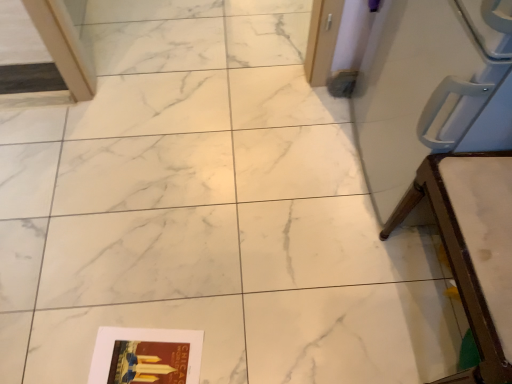
What do you see at coordinates (149, 362) in the screenshot? The height and width of the screenshot is (384, 512). I see `matte paper magazine at lower left` at bounding box center [149, 362].

At what (x,y) coordinates should I click in order to perform the action: click on matte paper magazine at lower left. Please return your answer as a coordinate pair (x, y). Looking at the image, I should click on (149, 362).

I want to click on white plastic chair at right, so click(x=472, y=242).

This screenshot has height=384, width=512. What do you see at coordinates (472, 242) in the screenshot?
I see `white plastic chair at right` at bounding box center [472, 242].

You are a GUI agent. You are given a task and a screenshot of the screen. Output one action in this format:
    pyautogui.click(x=<x>, y=<y>)
    Task: Click on the matte paper magazine at lower left
    Image resolution: width=512 pixels, height=384 pixels.
    Given the screenshot: What is the action you would take?
    pyautogui.click(x=149, y=362)

Can you confirm if matte paper magazine at lower left is positioned to the right of white plastic chair at right?

No.

Considering their positions, is matte paper magazine at lower left located in front of or behind white plastic chair at right?

Visually, matte paper magazine at lower left is located behind white plastic chair at right.

Does point (123, 360) come closer to viewer compared to point (458, 198)?

No, (123, 360) is further to viewer.

From the image's perspective, between matte paper magazine at lower left and white plastic chair at right, who is located below?

matte paper magazine at lower left, from the image's perspective.

From a real-world perspective, who is located lower, matte paper magazine at lower left or white plastic chair at right?

In real-world perspective, matte paper magazine at lower left is lower.

Which of these two, matte paper magazine at lower left or white plastic chair at right, is wider?

white plastic chair at right.

Considering the relative sizes of matte paper magazine at lower left and white plastic chair at right in the image provided, is matte paper magazine at lower left shorter than white plastic chair at right?

Correct, matte paper magazine at lower left is not as tall as white plastic chair at right.

Considering the sizes of matte paper magazine at lower left and white plastic chair at right in the image, is matte paper magazine at lower left bigger or smaller than white plastic chair at right?

In the image, matte paper magazine at lower left appears to be smaller than white plastic chair at right.

Is white plastic chair at right a part of matte paper magazine at lower left?

No.

Are matte paper magazine at lower left and white plastic chair at right beside each other?

No, matte paper magazine at lower left is not next to white plastic chair at right.

Is matte paper magazine at lower left facing away from white plastic chair at right?

Yes, matte paper magazine at lower left's orientation is away from white plastic chair at right.

Can you tell me how much matte paper magazine at lower left and white plastic chair at right differ in facing direction?

The facing directions of matte paper magazine at lower left and white plastic chair at right are 10.9 degrees apart.

In the image, there is a matte paper magazine at lower left. Identify the location of furniture above it (from the image's perspective). (472, 242).

Between white plastic chair at right and matte paper magazine at lower left, which one appears on the right side from the viewer's perspective?

white plastic chair at right.

Does white plastic chair at right lie in front of matte paper magazine at lower left?

Yes, white plastic chair at right is closer to the camera.

Considering the points (470, 176) and (141, 357), which point is in front, point (470, 176) or point (141, 357)?

Point (470, 176)

From the image's perspective, is white plastic chair at right below matte paper magazine at lower left?

Actually, white plastic chair at right appears above matte paper magazine at lower left in the image.

Based on the photo, from a real-world perspective, who is located lower, white plastic chair at right or matte paper magazine at lower left?

matte paper magazine at lower left is physically lower.

Between white plastic chair at right and matte paper magazine at lower left, which one has smaller width?

With smaller width is matte paper magazine at lower left.

From their relative heights in the image, would you say white plastic chair at right is taller or shorter than matte paper magazine at lower left?

Clearly, white plastic chair at right is taller compared to matte paper magazine at lower left.

Does white plastic chair at right have a larger size compared to matte paper magazine at lower left?

Yes, white plastic chair at right is bigger than matte paper magazine at lower left.

Would you say white plastic chair at right is outside matte paper magazine at lower left?

Absolutely, white plastic chair at right is external to matte paper magazine at lower left.

Is white plastic chair at right with matte paper magazine at lower left?

They are not placed beside each other.

Consider the image. Is white plastic chair at right looking in the opposite direction of matte paper magazine at lower left?

No, white plastic chair at right is not facing the opposite direction of matte paper magazine at lower left.

In order to click on magazine on the left side of white plastic chair at right in this screenshot , I will do `click(149, 362)`.

Locate an element on the screen. This screenshot has height=384, width=512. furniture above the matte paper magazine at lower left (from the image's perspective) is located at coordinates (472, 242).

Where is `magazine behind the white plastic chair at right`? magazine behind the white plastic chair at right is located at coordinates (149, 362).